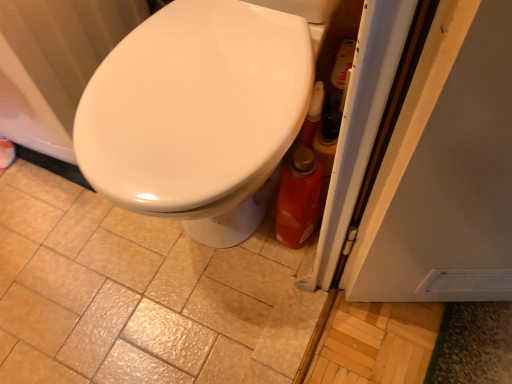
Identify the location of white glossy radiator at upper left. (54, 64).

What is the approximate width of white glossy bidet at center?

It is 26.02 inches.

What do you see at coordinates (138, 295) in the screenshot? I see `matte ceramic tile at center` at bounding box center [138, 295].

The width and height of the screenshot is (512, 384). In order to click on white glossy radiator at upper left in this screenshot , I will do `click(54, 64)`.

Considering the sizes of objects white glossy bidet at center and white glossy radiator at upper left in the image provided, who is bigger, white glossy bidet at center or white glossy radiator at upper left?

With larger size is white glossy bidet at center.

Is point (90, 162) closer to viewer compared to point (7, 30)?

Yes, point (90, 162) is in front of point (7, 30).

From the image's perspective, which is below, white glossy bidet at center or white glossy radiator at upper left?

white glossy bidet at center appears lower in the image.

Which point is more distant from viewer, (74, 76) or (48, 181)?

The point (48, 181) is more distant.

From the image's perspective, between white glossy radiator at upper left and matte ceramic tile at center, who is located below?

From the image's view, matte ceramic tile at center is below.

Who is smaller, white glossy radiator at upper left or matte ceramic tile at center?

matte ceramic tile at center.

From a real-world perspective, is white glossy radiator at upper left physically below matte ceramic tile at center?

No, from a real-world perspective, white glossy radiator at upper left is not beneath matte ceramic tile at center.

Is the depth of white glossy radiator at upper left greater than that of white glossy bidet at center?

Yes, it is behind white glossy bidet at center.

Locate an element on the screen. radiator below the white glossy bidet at center (from a real-world perspective) is located at coordinates (54, 64).

From the image's perspective, who appears lower, white glossy radiator at upper left or white glossy bidet at center?

From the image's view, white glossy bidet at center is below.

Based on their positions, is white glossy radiator at upper left located to the left or right of white glossy bidet at center?

In the image, white glossy radiator at upper left appears on the left side of white glossy bidet at center.

From the image's perspective, between matte ceramic tile at center and white glossy radiator at upper left, who is located below?

From the image's view, matte ceramic tile at center is below.

Is matte ceramic tile at center to the right of white glossy radiator at upper left from the viewer's perspective?

Yes.

Considering the relative sizes of matte ceramic tile at center and white glossy radiator at upper left in the image provided, is matte ceramic tile at center bigger than white glossy radiator at upper left?

Actually, matte ceramic tile at center might be smaller than white glossy radiator at upper left.

Choose the correct answer: Is matte ceramic tile at center inside white glossy radiator at upper left or outside it?

matte ceramic tile at center is located beyond the bounds of white glossy radiator at upper left.

Looking at their sizes, would you say matte ceramic tile at center is wider or thinner than white glossy bidet at center?

Considering their sizes, matte ceramic tile at center looks broader than white glossy bidet at center.

From a real-world perspective, is matte ceramic tile at center on white glossy bidet at center?

Actually, matte ceramic tile at center is physically below white glossy bidet at center in the real world.

From the picture: What's the angular difference between matte ceramic tile at center and white glossy bidet at center's facing directions?

89 degrees.

Are matte ceramic tile at center and white glossy bidet at center beside each other?

matte ceramic tile at center is not next to white glossy bidet at center, and they're not touching.

Is white glossy bidet at center beside matte ceramic tile at center?

No, white glossy bidet at center is not in contact with matte ceramic tile at center.

Considering their positions, is white glossy bidet at center located in front of or behind matte ceramic tile at center?

white glossy bidet at center is in front of matte ceramic tile at center.

Consider the image. Considering the sizes of white glossy bidet at center and matte ceramic tile at center in the image, is white glossy bidet at center taller or shorter than matte ceramic tile at center?

Clearly, white glossy bidet at center is taller compared to matte ceramic tile at center.

From the image's perspective, is white glossy bidet at center located above matte ceramic tile at center?

Yes, from the image's perspective, white glossy bidet at center is over matte ceramic tile at center.

Locate an element on the screen. Image resolution: width=512 pixels, height=384 pixels. bidet lying on the right of white glossy radiator at upper left is located at coordinates (197, 114).

You are a GUI agent. You are given a task and a screenshot of the screen. Output one action in this format:
    pyautogui.click(x=<x>, y=<y>)
    Task: Click on the ceramic tile that is below the white glossy radiator at upper left (from the image's perspective)
    
    Given the screenshot: What is the action you would take?
    pyautogui.click(x=138, y=295)

Based on their spatial positions, is white glossy bidet at center or matte ceramic tile at center further from white glossy radiator at upper left?

Based on the image, matte ceramic tile at center appears to be further to white glossy radiator at upper left.

Based on their spatial positions, is white glossy radiator at upper left or matte ceramic tile at center further from white glossy bidet at center?

matte ceramic tile at center.

Estimate the real-world distances between objects in this image. Which object is closer to white glossy bidet at center, matte ceramic tile at center or white glossy radiator at upper left?

Among the two, white glossy radiator at upper left is located nearer to white glossy bidet at center.

From the image, which object appears to be nearer to matte ceramic tile at center, white glossy bidet at center or white glossy radiator at upper left?

Based on the image, white glossy radiator at upper left appears to be nearer to matte ceramic tile at center.

Which object lies further to the anchor point matte ceramic tile at center, white glossy radiator at upper left or white glossy bidet at center?

Based on the image, white glossy bidet at center appears to be further to matte ceramic tile at center.

Based on their spatial positions, is matte ceramic tile at center or white glossy bidet at center further from white glossy radiator at upper left?

matte ceramic tile at center.

Where is `bidet between white glossy radiator at upper left and matte ceramic tile at center in the vertical direction`? Image resolution: width=512 pixels, height=384 pixels. bidet between white glossy radiator at upper left and matte ceramic tile at center in the vertical direction is located at coordinates (197, 114).